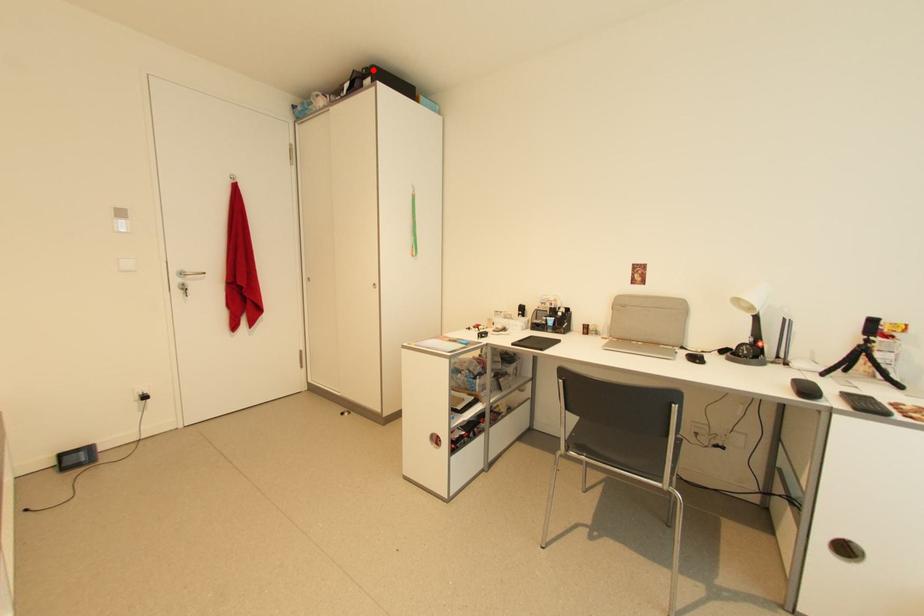
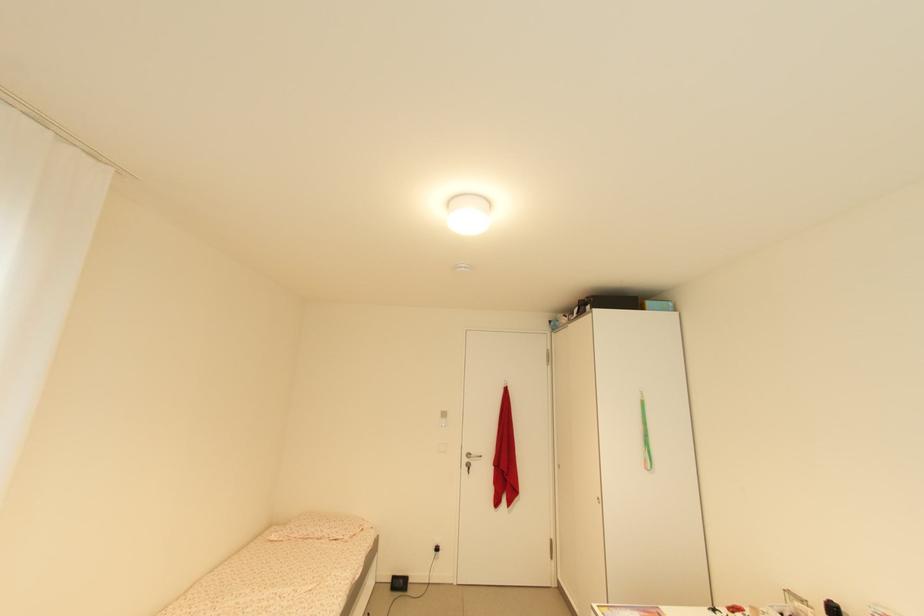
Locate, in the second image, the point that corresponds to the highlighted location in the first image.

(592, 299)